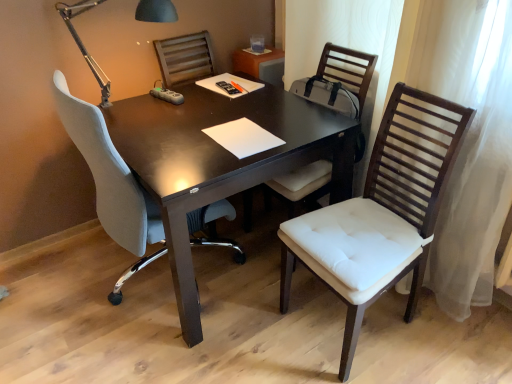
Locate an element on the screen. The width and height of the screenshot is (512, 384). free area in between matte black table lamp at upper left and white paper at center is located at coordinates (187, 130).